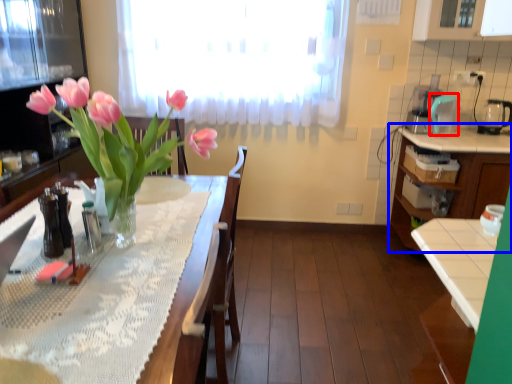
Question: Which object appears farthest to the camera in this image, appliance (highlighted by a red box) or cabinetry (highlighted by a blue box)?

Choices:
 (A) appliance
 (B) cabinetry

Answer: (A)